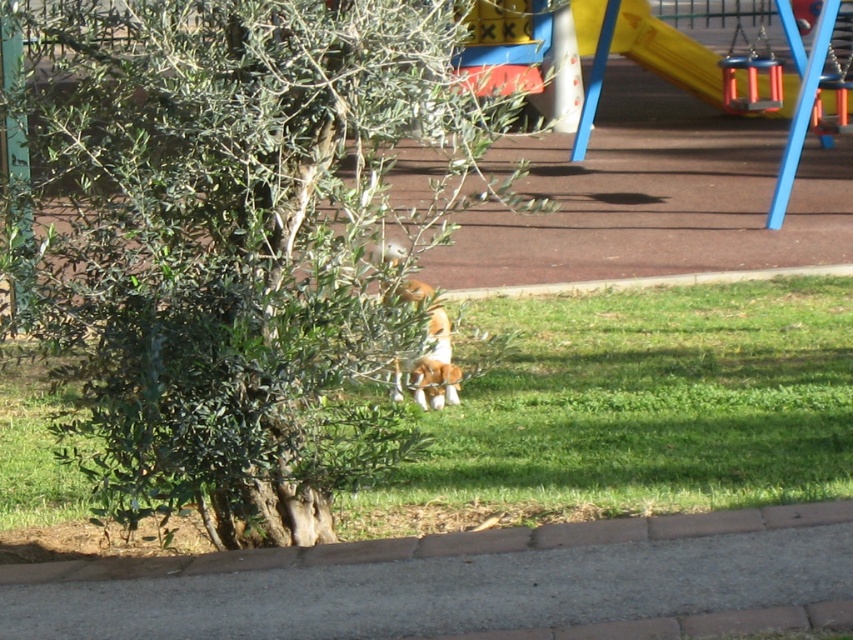
Question: Can you confirm if green leafy tree at center is bigger than brown fur dog at center?

Choices:
 (A) no
 (B) yes

Answer: (B)

Question: Can you confirm if green grass at center is thinner than brown fur dog at center?

Choices:
 (A) yes
 (B) no

Answer: (B)

Question: Based on their relative distances, which object is farther from the green leafy tree at center?

Choices:
 (A) brown fur dog at center
 (B) green grass at center

Answer: (A)

Question: Can you confirm if green leafy tree at center is positioned to the left of brown fur dog at center?

Choices:
 (A) yes
 (B) no

Answer: (A)

Question: Which of these objects is positioned farthest from the brown fur dog at center?

Choices:
 (A) green grass at center
 (B) green leafy tree at center

Answer: (B)

Question: Which point appears closest to the camera in this image?

Choices:
 (A) (419, 380)
 (B) (193, 538)
 (C) (189, 70)

Answer: (C)